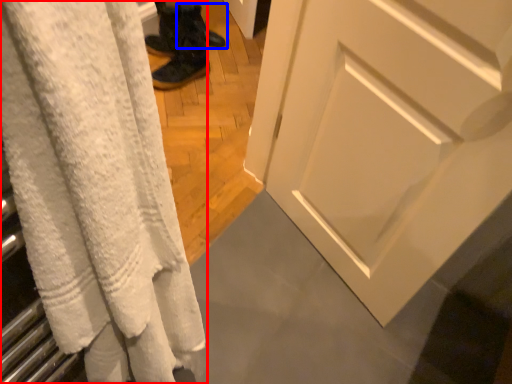
Question: Which object appears closest to the camera in this image, curtain (highlighted by a red box) or footwear (highlighted by a blue box)?

Choices:
 (A) curtain
 (B) footwear

Answer: (A)